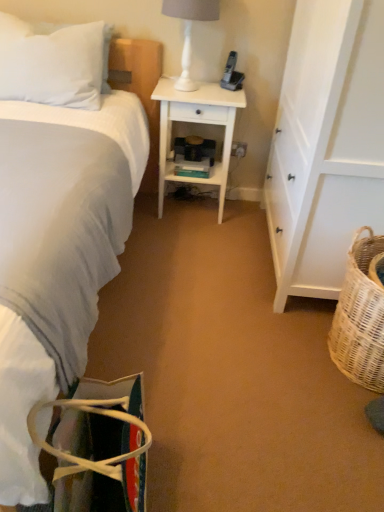
The image size is (384, 512). In order to click on vacant space to the right of white glossy lamp at upper center in this screenshot , I will do `click(223, 93)`.